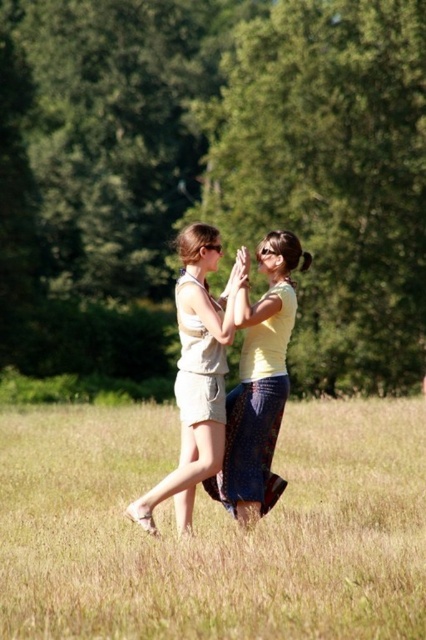
Looking at this image, is green leafy tree at center to the left of beige cotton shorts at center from the viewer's perspective?

Yes, green leafy tree at center is to the left of beige cotton shorts at center.

Is point (256, 17) closer to camera compared to point (224, 362)?

No, it is behind (224, 362).

Where is `green leafy tree at center`? green leafy tree at center is located at coordinates (212, 176).

Can you confirm if grassy field at center is smaller than yellow matte skirt at center?

No.

Based on the photo, is grassy field at center wider than yellow matte skirt at center?

Correct, the width of grassy field at center exceeds that of yellow matte skirt at center.

In order to click on grassy field at center in this screenshot , I will do `click(213, 529)`.

Is yellow matte skirt at center to the right of beige cotton shorts at center from the viewer's perspective?

Yes, yellow matte skirt at center is to the right of beige cotton shorts at center.

The width and height of the screenshot is (426, 640). I want to click on yellow matte skirt at center, so click(x=259, y=384).